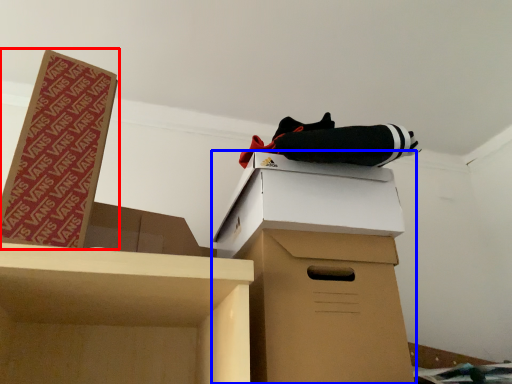
Question: Among these objects, which one is farthest to the camera, box (highlighted by a red box) or cardboard box (highlighted by a blue box)?

Choices:
 (A) box
 (B) cardboard box

Answer: (B)